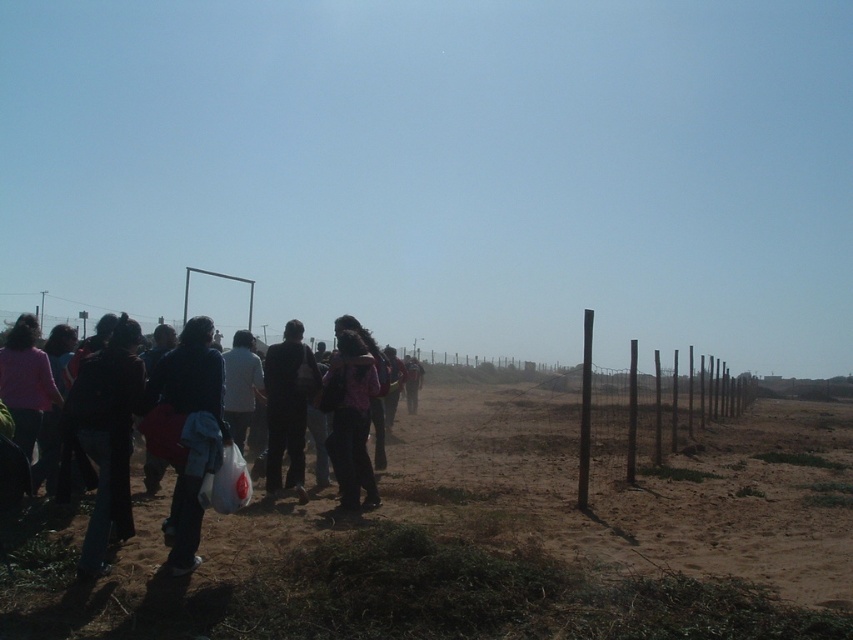
Question: Among these objects, which one is farthest from the camera?

Choices:
 (A) brown wooden fence at right
 (B) pink fabric backpack at center
 (C) dark brown leather jacket at left
 (D) brown sandy dirt field at lower center

Answer: (A)

Question: Is brown sandy dirt field at lower center positioned in front of dark blue suit at center?

Choices:
 (A) no
 (B) yes

Answer: (B)

Question: Which of the following is the farthest from the observer?

Choices:
 (A) brown wooden fence at right
 (B) pink fabric backpack at center
 (C) dark blue fabric jacket at left

Answer: (A)

Question: Is brown sandy dirt field at lower center closer to the viewer compared to dark clothing group at left?

Choices:
 (A) no
 (B) yes

Answer: (B)

Question: Which point is farther to the camera?

Choices:
 (A) (819, 502)
 (B) (339, 346)

Answer: (A)

Question: Is brown sandy dirt field at lower center to the right of dark brown leather jacket at left from the viewer's perspective?

Choices:
 (A) no
 (B) yes

Answer: (B)